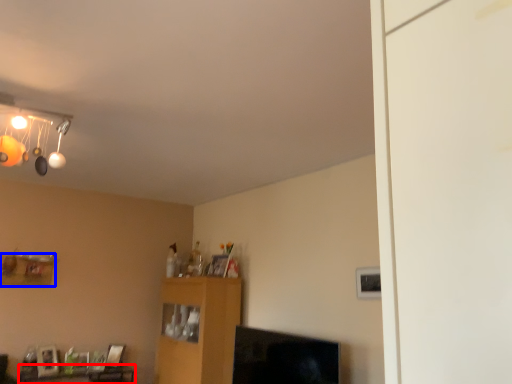
Question: Among these objects, which one is nearest to the camera, table (highlighted by a red box) or shelf (highlighted by a blue box)?

Choices:
 (A) table
 (B) shelf

Answer: (A)